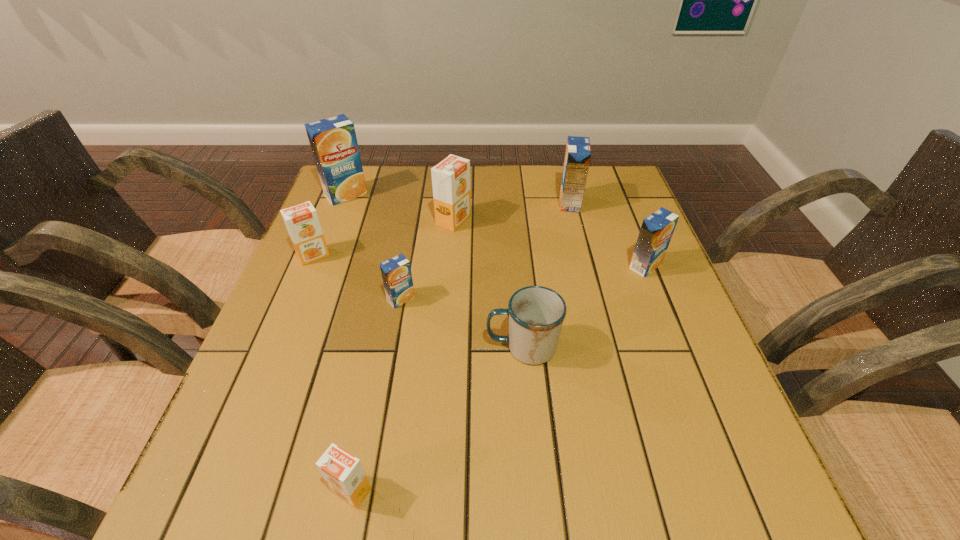
In the image, there is a desktop. At what (x,y) coordinates should I click in order to perform the action: click on free space at the near edge. Please return your answer as a coordinate pair (x, y). Looking at the image, I should click on (610, 503).

In the image, there is a desktop. Where is `free region at the left edge`? This screenshot has height=540, width=960. free region at the left edge is located at coordinates (330, 275).

Identify the location of vacant space at the right edge of the desktop. (660, 442).

In the image, there is a desktop. Identify the location of vacant space at the far left corner. The image size is (960, 540). (369, 192).

I want to click on vacant space at the near left corner, so click(241, 472).

At what (x,y) coordinates should I click in order to perform the action: click on free space at the far right corner of the desktop. Please return your answer as a coordinate pair (x, y). Looking at the image, I should click on (592, 168).

The image size is (960, 540). Find the location of `empty space between the smallest orange orange juice and the second smallest orange orange juice`. empty space between the smallest orange orange juice and the second smallest orange orange juice is located at coordinates (332, 373).

Locate an element on the screen. The image size is (960, 540). free space between the second nearest orange orange juice and the biggest orange orange juice is located at coordinates (383, 238).

You are a GUI agent. You are given a task and a screenshot of the screen. Output one action in this format:
    pyautogui.click(x=<x>, y=<y>)
    Task: Click on the free space between the second biggest blue orange_juice and the smallest orange orange juice
    The height and width of the screenshot is (540, 960).
    Given the screenshot: What is the action you would take?
    pyautogui.click(x=461, y=347)

I want to click on blank region between the rightmost blue orange_juice and the tallest object, so click(x=495, y=230).